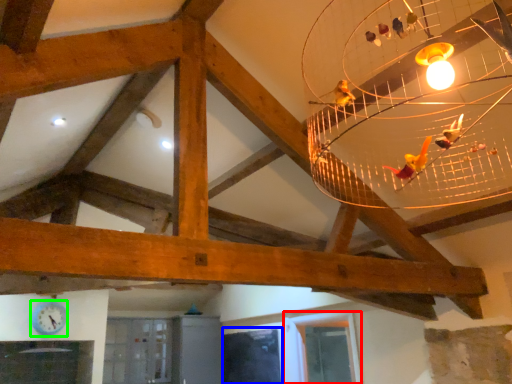
Question: Which object is the farthest from window (highlighted by a red box)? Choose among these: window (highlighted by a blue box) or clock (highlighted by a green box).

Choices:
 (A) window
 (B) clock

Answer: (B)